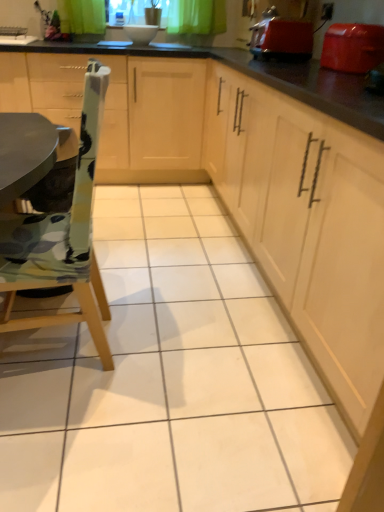
Question: Should I look upward or downward to see matte red toaster at upper right, the first appliance in the back-to-front sequence?

Choices:
 (A) up
 (B) down

Answer: (A)

Question: Can you confirm if wooden chair at left is thinner than matte wood cabinets at center, which is the 1th cabinetry in left-to-right order?

Choices:
 (A) no
 (B) yes

Answer: (B)

Question: Considering the relative sizes of wooden chair at left and matte wood cabinets at center, the second cabinetry in the right-to-left sequence, in the image provided, is wooden chair at left shorter than matte wood cabinets at center, the second cabinetry in the right-to-left sequence,?

Choices:
 (A) no
 (B) yes

Answer: (A)

Question: Is wooden chair at left in front of matte wood cabinets at center, which is the 1th cabinetry in left-to-right order?

Choices:
 (A) no
 (B) yes

Answer: (B)

Question: Is wooden chair at left wider than matte wood cabinets at center, the second cabinetry in the right-to-left sequence?

Choices:
 (A) yes
 (B) no

Answer: (B)

Question: Would you say matte wood cabinets at center, which is the 1th cabinetry in left-to-right order, is part of wooden chair at left's contents?

Choices:
 (A) no
 (B) yes

Answer: (A)

Question: From a real-world perspective, is wooden chair at left on top of matte wood cabinets at center, which is the 1th cabinetry in left-to-right order?

Choices:
 (A) yes
 (B) no

Answer: (A)

Question: Could you tell me if light wood cabinet at center, arranged as the first cabinetry when viewed from the right, is turned towards shiny plastic toaster at upper right, the first appliance in the right-to-left sequence?

Choices:
 (A) yes
 (B) no

Answer: (B)

Question: Is light wood cabinet at center, placed as the 2th cabinetry when sorted from left to right, outside shiny plastic toaster at upper right, which appears as the first appliance when viewed from the front?

Choices:
 (A) yes
 (B) no

Answer: (A)

Question: Does light wood cabinet at center, placed as the 2th cabinetry when sorted from left to right, have a lesser width compared to shiny plastic toaster at upper right, which appears as the first appliance when viewed from the front?

Choices:
 (A) no
 (B) yes

Answer: (A)

Question: Is light wood cabinet at center, placed as the 2th cabinetry when sorted from left to right, shorter than shiny plastic toaster at upper right, which appears as the first appliance when viewed from the front?

Choices:
 (A) yes
 (B) no

Answer: (B)

Question: Are light wood cabinet at center, arranged as the first cabinetry when viewed from the right, and shiny plastic toaster at upper right, which ranks as the 2th appliance in back-to-front order, located far from each other?

Choices:
 (A) no
 (B) yes

Answer: (A)

Question: Would you say light wood cabinet at center, placed as the 2th cabinetry when sorted from left to right, contains shiny plastic toaster at upper right, the first appliance in the right-to-left sequence?

Choices:
 (A) no
 (B) yes

Answer: (A)

Question: From a real-world perspective, is wooden chair at left beneath shiny plastic toaster at upper right, the first appliance in the right-to-left sequence?

Choices:
 (A) no
 (B) yes

Answer: (B)